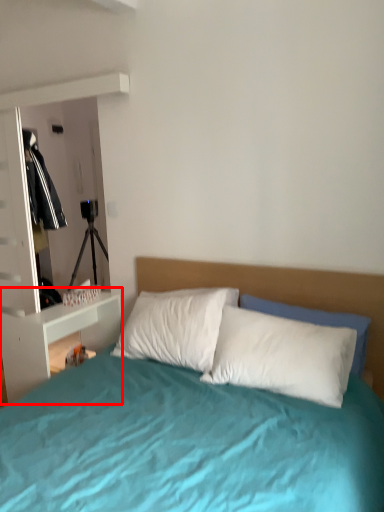
Question: From the image's perspective, what is the correct spatial relationship of nightstand (annotated by the red box) in relation to pillow?

Choices:
 (A) below
 (B) above

Answer: (A)